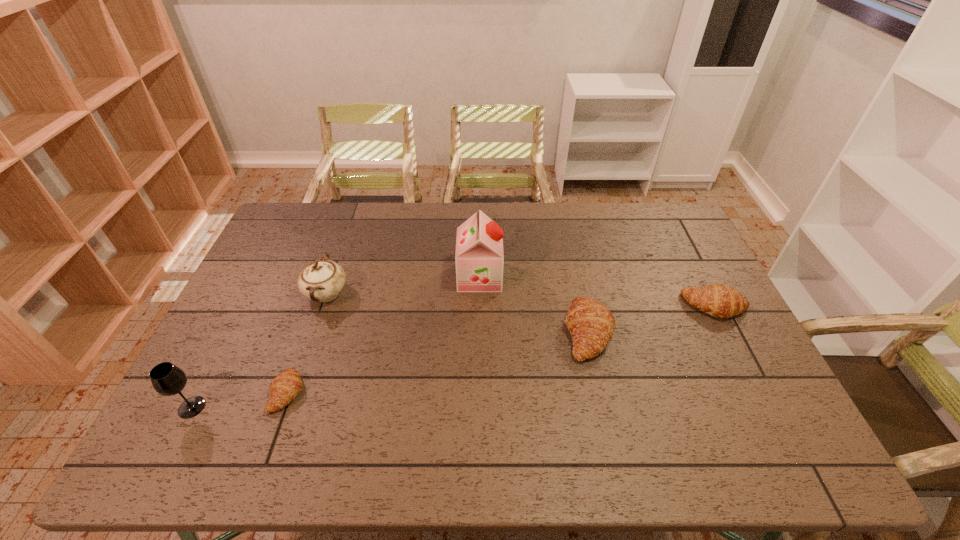
Identify the location of the leftmost crescent roll. This screenshot has height=540, width=960. (287, 385).

Locate an element on the screen. The image size is (960, 540). the shortest object is located at coordinates (287, 385).

I want to click on the second object from right to left, so click(591, 325).

What are the coordinates of `the second shortest crescent roll` in the screenshot? It's located at (720, 301).

Where is `the rightmost object`? The height and width of the screenshot is (540, 960). the rightmost object is located at coordinates (720, 301).

Find the location of a particular element. Image resolution: width=960 pixels, height=540 pixels. chinaware is located at coordinates (322, 280).

Locate an element on the screen. the fourth object from left to right is located at coordinates (479, 258).

Locate an element on the screen. The image size is (960, 540). soya milk is located at coordinates (479, 258).

I want to click on the leftmost object, so click(167, 379).

Identify the location of free location located on the back of the nearest crescent roll. [309, 330].